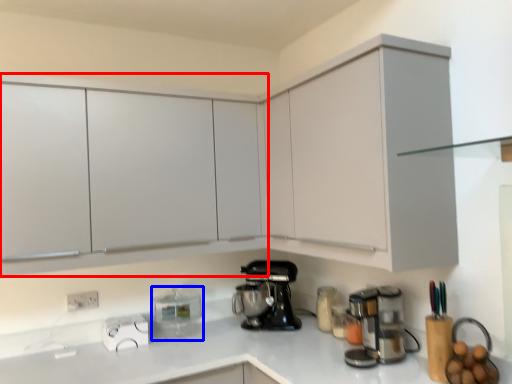
Question: Which object appears farthest to the camera in this image, cabinetry (highlighted by a red box) or kitchen appliance (highlighted by a blue box)?

Choices:
 (A) cabinetry
 (B) kitchen appliance

Answer: (B)